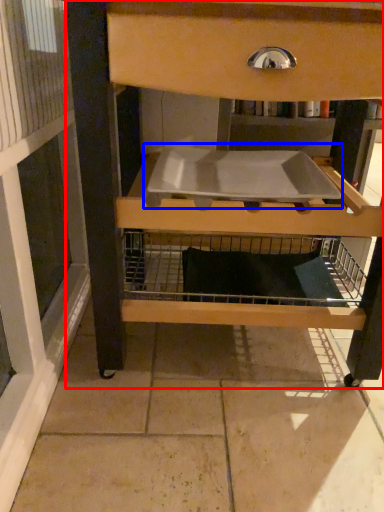
Question: Among these objects, which one is nearest to the camera, furniture (highlighted by a red box) or sink (highlighted by a blue box)?

Choices:
 (A) furniture
 (B) sink

Answer: (A)